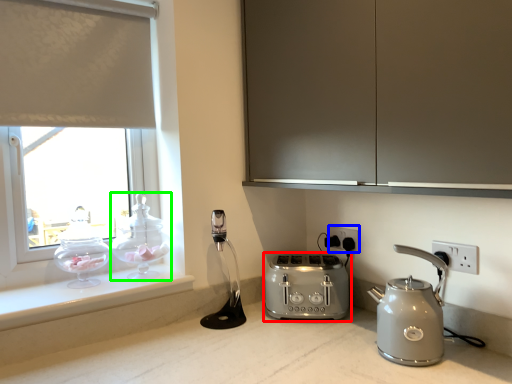
Question: Based on their relative distances, which object is farther from toaster (highlighted by a red box)? Choose from electric outlet (highlighted by a blue box) and tea pot (highlighted by a green box).

Choices:
 (A) electric outlet
 (B) tea pot

Answer: (B)